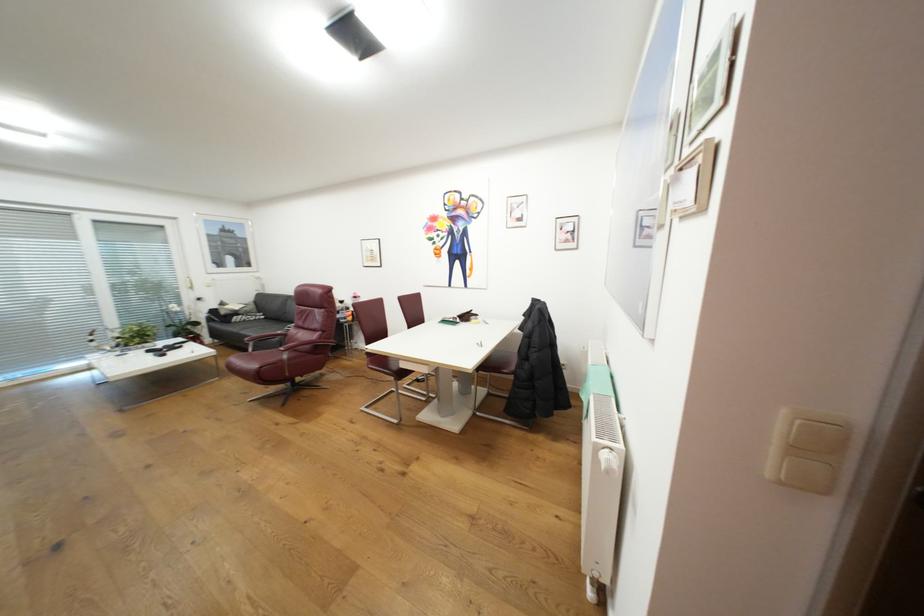
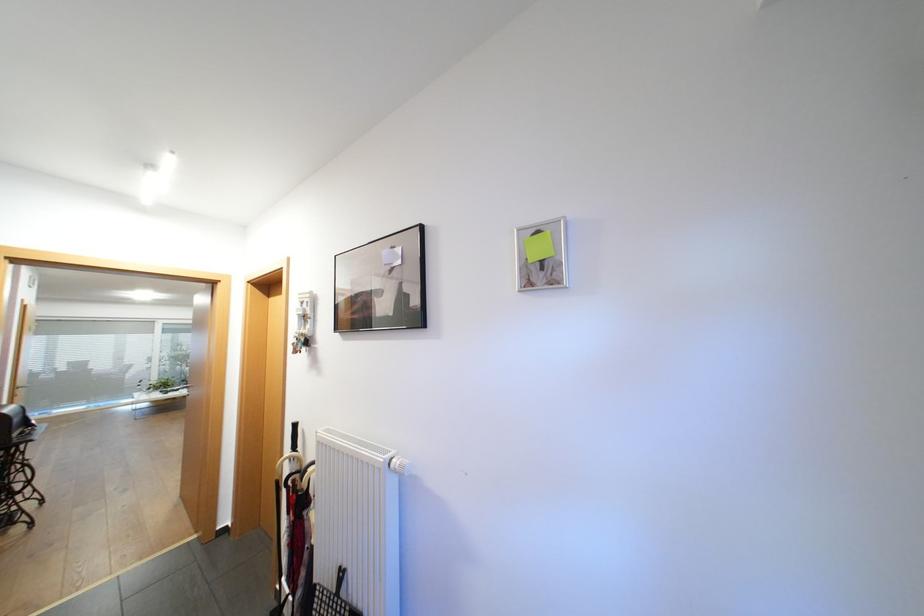
Question: I am providing you with two images of the same scene from different viewpoints. Please identify which objects are invisible in image2.

Choices:
 (A) maroon chair sitting surface
 (B) set of keys
 (C) purple soap dispenser pump
 (D) green sticky note

Answer: (A)